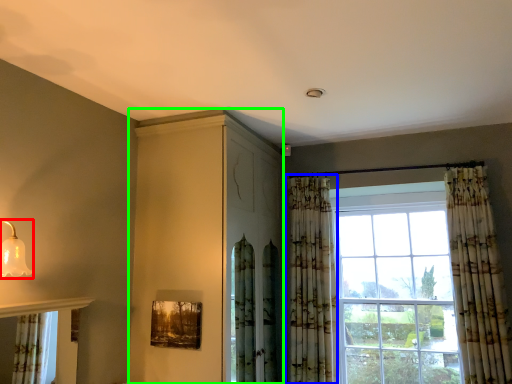
Question: Considering the real-world distances, which object is closest to light fixture (highlighted by a red box)? curtain (highlighted by a blue box) or dresser (highlighted by a green box).

Choices:
 (A) curtain
 (B) dresser

Answer: (B)